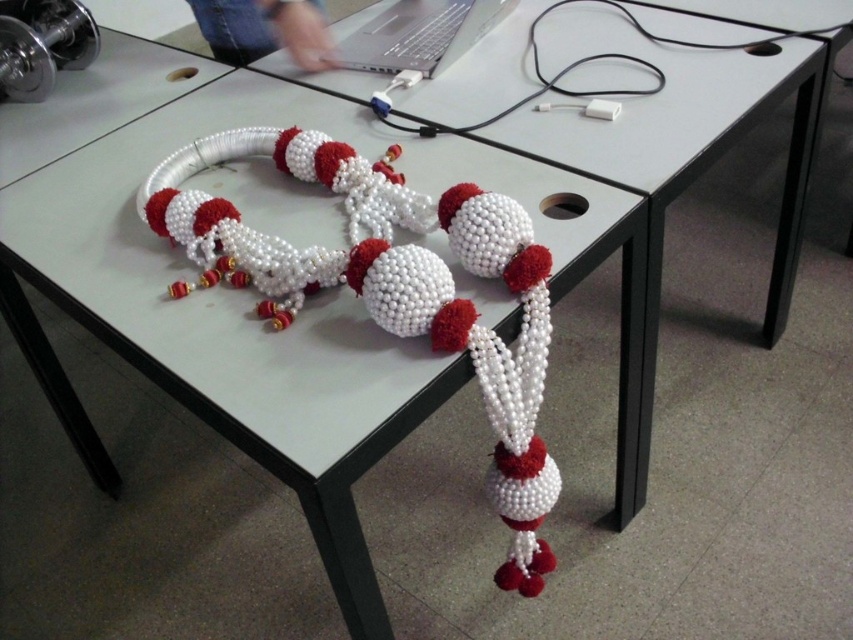
Does point (469, 10) come behind point (602, 93)?

Yes.

In the scene shown: Can you confirm if silver metallic laptop at upper center is thinner than white matte cable at upper center?

Indeed, silver metallic laptop at upper center has a lesser width compared to white matte cable at upper center.

I want to click on silver metallic laptop at upper center, so click(421, 35).

Locate an element on the screen. Image resolution: width=853 pixels, height=640 pixels. silver metallic laptop at upper center is located at coordinates (421, 35).